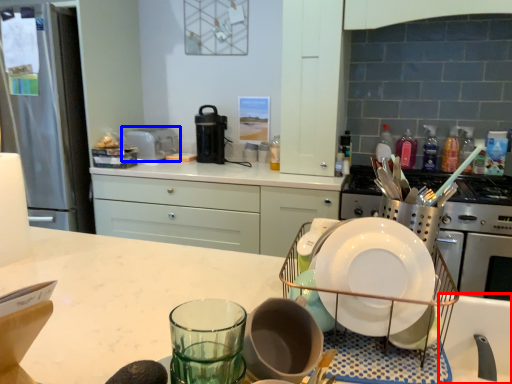
Question: Among these objects, which one is farthest to the camera, sink (highlighted by a red box) or appliance (highlighted by a blue box)?

Choices:
 (A) sink
 (B) appliance

Answer: (B)